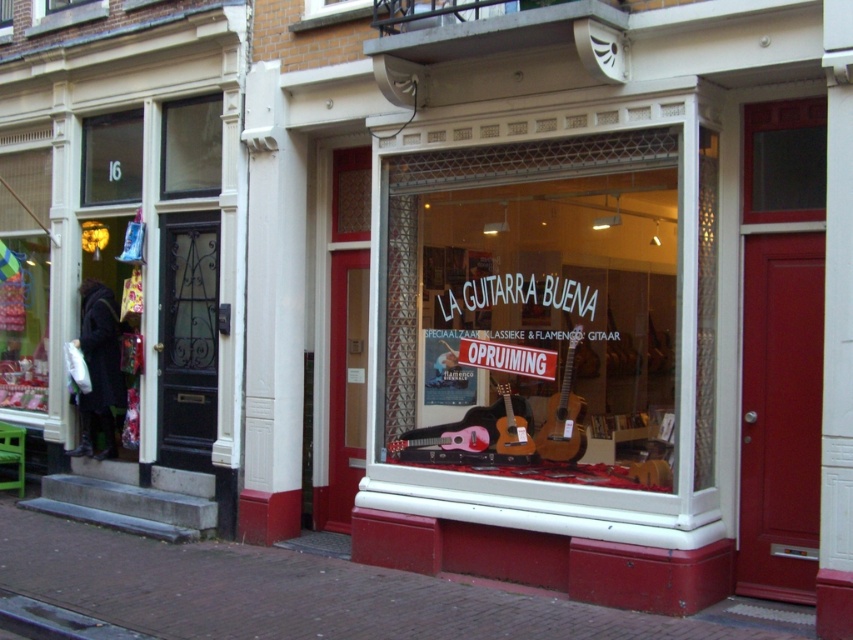
Question: Among these objects, which one is nearest to the camera?

Choices:
 (A) clear glass window at upper left
 (B) clear glass guitars at center

Answer: (B)

Question: Which of the following is the closest to the observer?

Choices:
 (A) clear glass window at upper left
 (B) clear glass guitars at center

Answer: (B)

Question: In this image, where is clear glass guitars at center located relative to clear glass window at upper left?

Choices:
 (A) above
 (B) below

Answer: (B)

Question: Does clear glass guitars at center appear over clear glass window at upper left?

Choices:
 (A) yes
 (B) no

Answer: (B)

Question: Is clear glass guitars at center smaller than clear glass window at upper left?

Choices:
 (A) no
 (B) yes

Answer: (A)